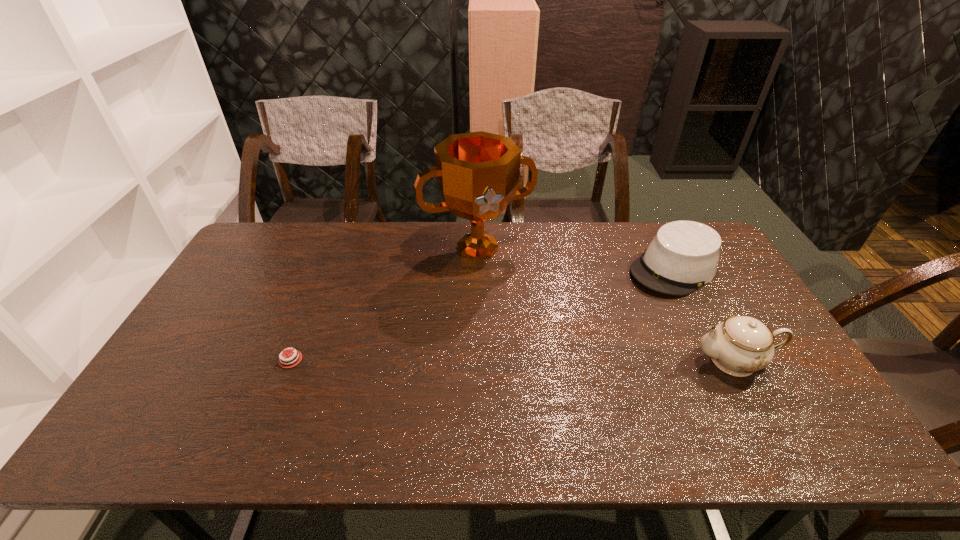
Locate an element on the screen. This screenshot has height=540, width=960. the leftmost object is located at coordinates (291, 360).

Find the location of a particular element. This screenshot has height=540, width=960. chocolate cake is located at coordinates (291, 360).

Locate an element on the screen. Image resolution: width=960 pixels, height=540 pixels. the second tallest object is located at coordinates (740, 345).

Locate an element on the screen. the second shortest object is located at coordinates (683, 256).

Locate an element on the screen. This screenshot has height=540, width=960. award is located at coordinates (478, 173).

Where is `the third object from right to left`? The width and height of the screenshot is (960, 540). the third object from right to left is located at coordinates (478, 173).

Find the location of a particular element. free space located on the back of the shortest object is located at coordinates (305, 323).

Identify the location of free region located at the spout of the chinaware. (601, 361).

At what (x,y) coordinates should I click in order to perform the action: click on vacant area situated at the spout of the chinaware. Please return your answer as a coordinate pair (x, y). This screenshot has width=960, height=540. Looking at the image, I should click on (605, 361).

This screenshot has width=960, height=540. Find the location of `vacant position located at the spout of the chinaware`. vacant position located at the spout of the chinaware is located at coordinates (541, 361).